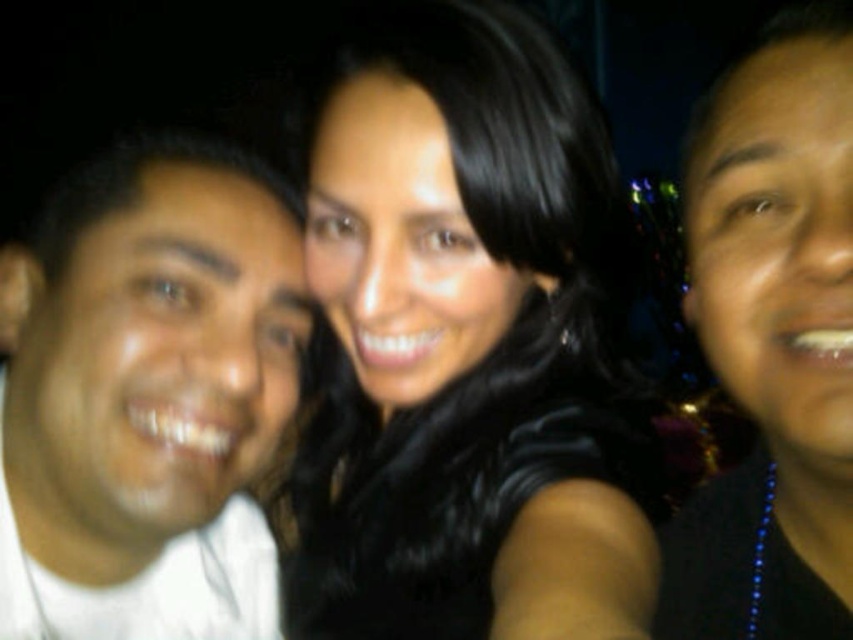
Question: Which point is farther to the camera?

Choices:
 (A) black leather hair at center
 (B) black matte necklace at center

Answer: (A)

Question: Among these objects, which one is nearest to the camera?

Choices:
 (A) white matte shirt at left
 (B) black matte necklace at center

Answer: (B)

Question: Does white matte shirt at left appear on the right side of black matte necklace at center?

Choices:
 (A) no
 (B) yes

Answer: (A)

Question: Can you confirm if white matte shirt at left is positioned to the left of black matte necklace at center?

Choices:
 (A) yes
 (B) no

Answer: (A)

Question: Is black leather hair at center positioned at the back of white matte shirt at left?

Choices:
 (A) no
 (B) yes

Answer: (A)

Question: Considering the real-world distances, which object is closest to the white matte shirt at left?

Choices:
 (A) black matte necklace at center
 (B) black leather hair at center

Answer: (B)